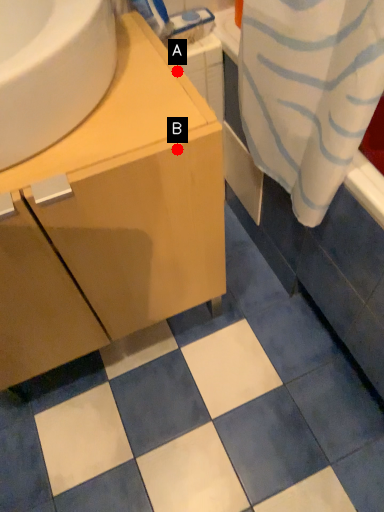
Question: Two points are circled on the image, labeled by A and B beside each circle. Which point is farther to the camera?

Choices:
 (A) A is further
 (B) B is further

Answer: (A)